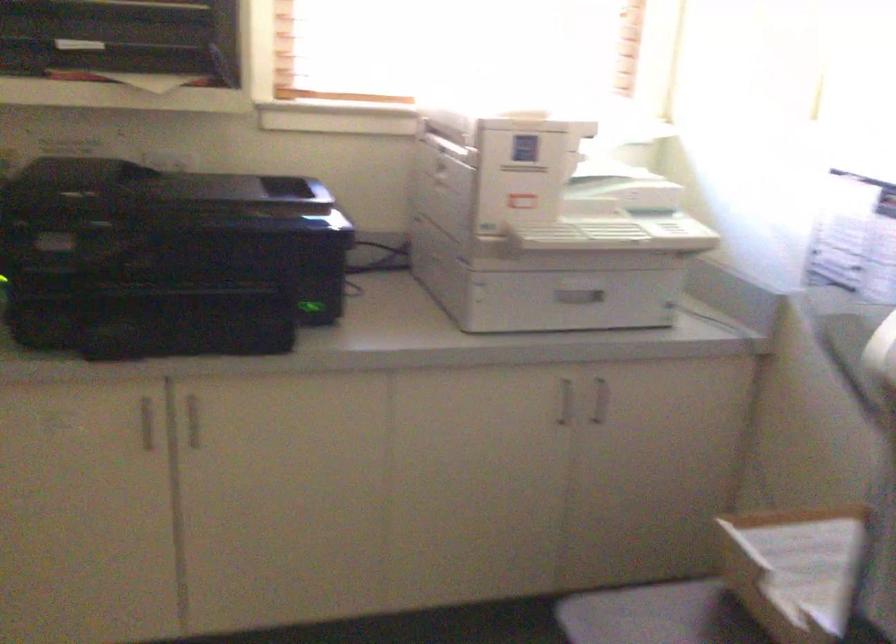
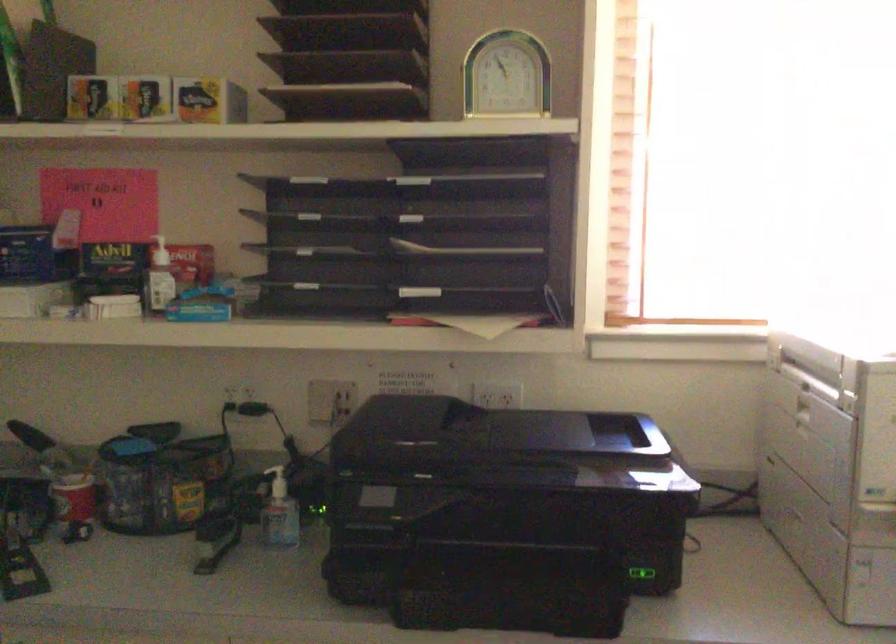
Question: What movement of the cameraman would produce the second image?

Choices:
 (A) Left
 (B) Right
 (C) Forward
 (D) Backward

Answer: (C)